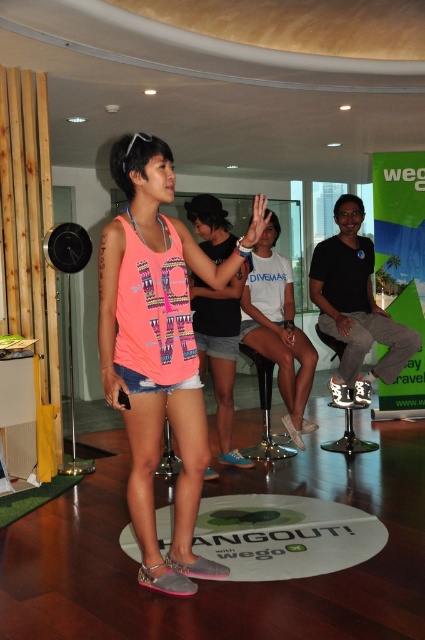
You are a photographer setting up a shoot in the lounge. You need to ensure that the pink fabric tank top at center is visible without being blocked by the metallic silver stool at center. Based on the scene description, is this possible?

Yes, the pink fabric tank top at center is in front of the metallic silver stool at center, so it will naturally be visible without obstruction from the stool.